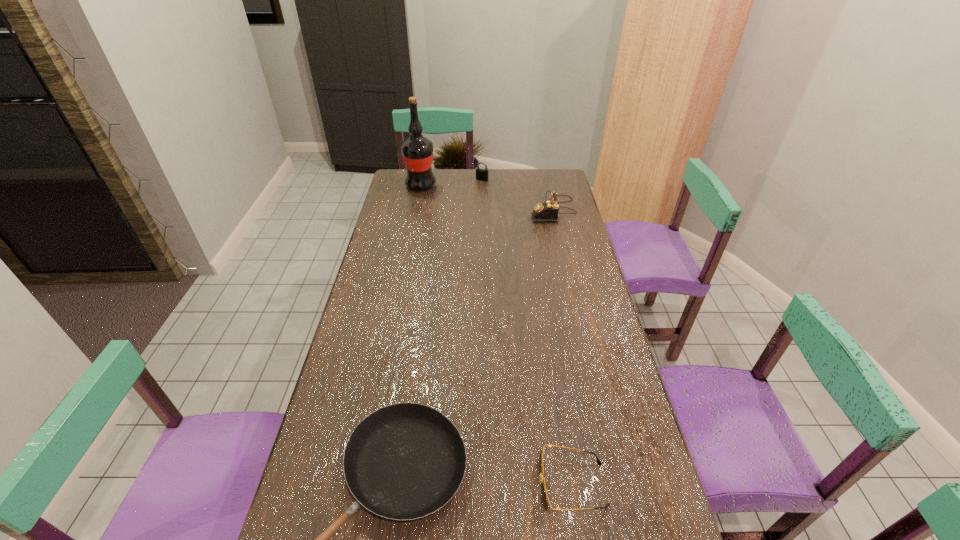
This screenshot has height=540, width=960. What are the coordinates of `vacant space at the far edge of the desktop` in the screenshot? It's located at (523, 184).

In the image, there is a desktop. What are the coordinates of `vacant space at the left edge` in the screenshot? It's located at (417, 197).

In the image, there is a desktop. Where is `free space at the right edge`? This screenshot has width=960, height=540. free space at the right edge is located at coordinates (593, 424).

The width and height of the screenshot is (960, 540). I want to click on free space between the padlock and the fourth shortest object, so click(517, 195).

What are the coordinates of `vacant area between the third object from right to left and the telephone` in the screenshot? It's located at (517, 195).

What are the coordinates of `blank region between the padlock and the second tallest object` in the screenshot? It's located at (517, 195).

The image size is (960, 540). In order to click on empty space between the wine bottle and the third object from left to right in this screenshot , I will do `click(451, 183)`.

Locate an element on the screen. vacant region between the sunglasses and the wine bottle is located at coordinates (496, 335).

At what (x,y) coordinates should I click in order to perform the action: click on free spot between the wine bottle and the third object from right to left. Please return your answer as a coordinate pair (x, y). Image resolution: width=960 pixels, height=540 pixels. Looking at the image, I should click on (451, 183).

Locate an element on the screen. This screenshot has width=960, height=540. free spot between the wine bottle and the third object from right to left is located at coordinates click(451, 183).